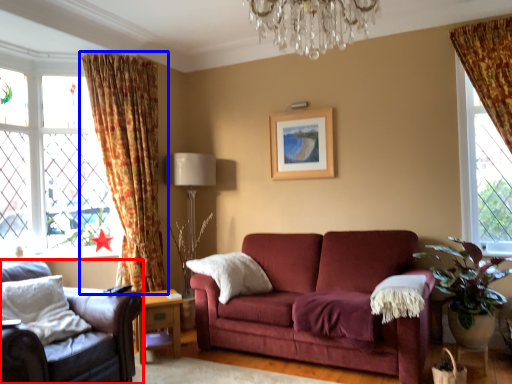
Question: Which of the following is the closest to the observer, chair (highlighted by a red box) or curtain (highlighted by a blue box)?

Choices:
 (A) chair
 (B) curtain

Answer: (A)